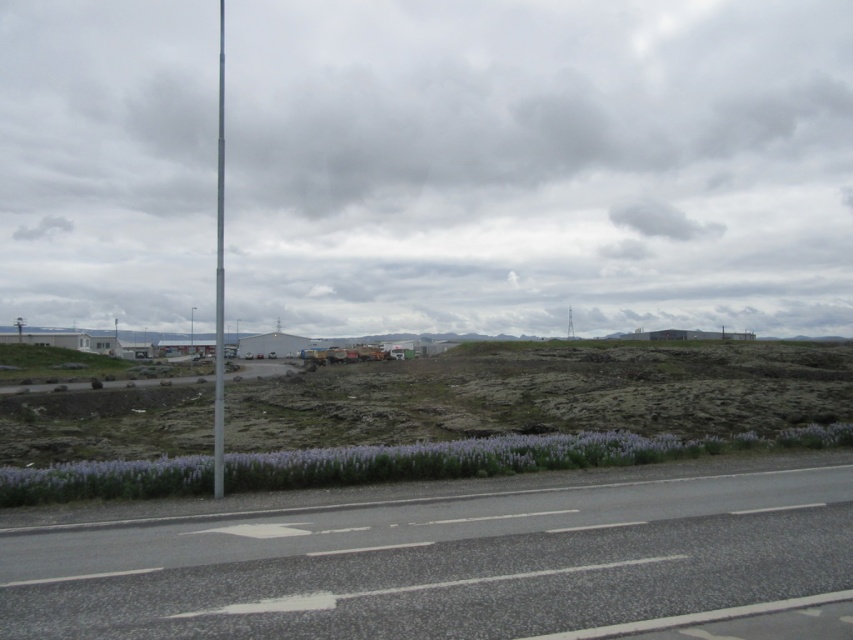
You are a driver approaching the gray asphalt highway at lower center and see the metallic pole at left. Which object is taller from your perspective?

The metallic pole at left is taller than the gray asphalt highway at lower center.

You are driving a truck that is 40 feet long. You need to make a U turn on the gray asphalt highway at lower center. Can you safely complete the U turn without hitting the metallic pole at left?

The gray asphalt highway at lower center is 34.95 feet from the metallic pole at left. Since your truck is 40 feet long, which is longer than the distance between the highway and the pole, you cannot safely complete the U turn without risking collision with the metallic pole at left.

You are driving a car that is 4.5 meters long. You want to park your car on the gray asphalt highway at lower center. Is there enough space to park your car there?

The gray asphalt highway at lower center is 5.07 meters away from camera, so yes, the car can park there since the distance is greater than the car length of 4.5 meters.